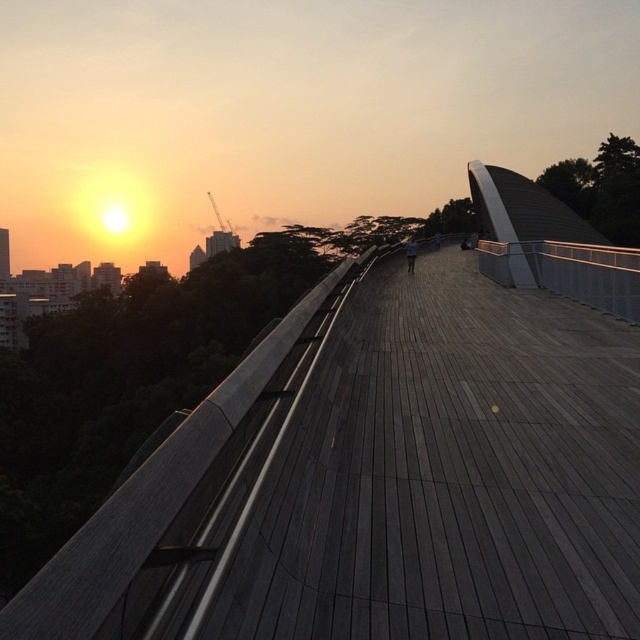
Question: Is dark gray fabric at center to the right of dark blue jeans at center from the viewer's perspective?

Choices:
 (A) yes
 (B) no

Answer: (B)

Question: Among these objects, which one is nearest to the camera?

Choices:
 (A) dark gray fabric at center
 (B) dark blue jeans at center

Answer: (A)

Question: Does dark gray fabric at center appear over dark blue jeans at center?

Choices:
 (A) no
 (B) yes

Answer: (A)

Question: Among these objects, which one is farthest from the camera?

Choices:
 (A) dark gray fabric at center
 (B) dark blue jeans at center

Answer: (B)

Question: Which point appears farthest from the camera in this image?

Choices:
 (A) [x=404, y=246]
 (B) [x=435, y=230]

Answer: (B)

Question: Where is dark gray fabric at center located in relation to dark blue jeans at center in the image?

Choices:
 (A) right
 (B) left

Answer: (B)